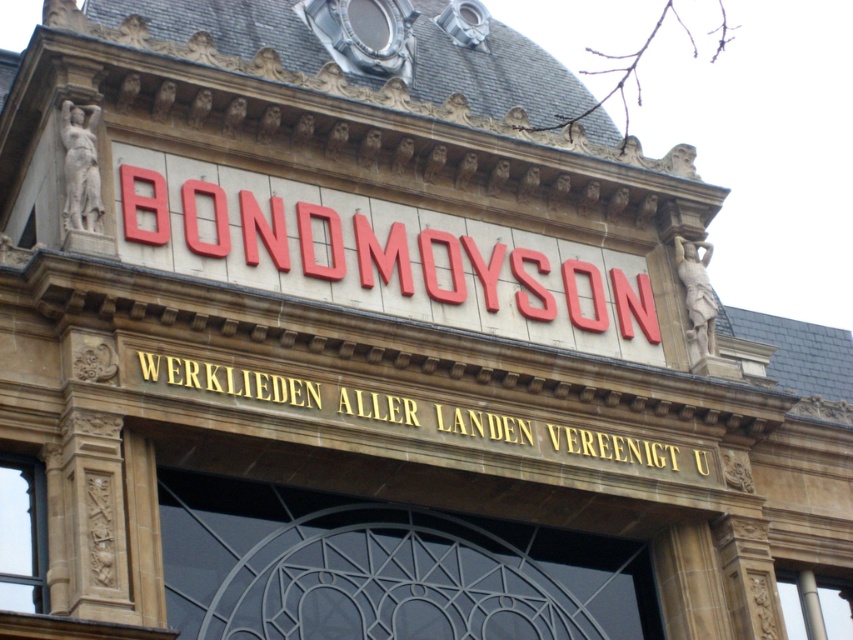
Is red plastic sign at center behind goldmaterial/textureinscription at center?

Yes.

Image resolution: width=853 pixels, height=640 pixels. Identify the location of red plastic sign at center. (376, 253).

Locate an element on the screen. red plastic sign at center is located at coordinates (376, 253).

Locate an element on the screen. Image resolution: width=853 pixels, height=640 pixels. red plastic sign at center is located at coordinates (376, 253).